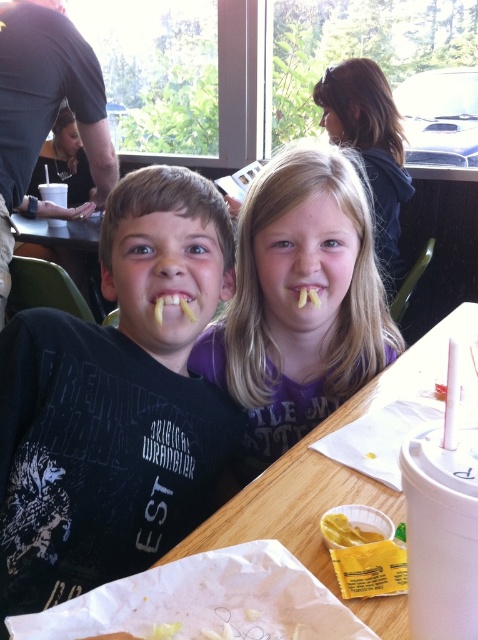
Is point (369, 115) positioned after point (155, 300)?

Yes, point (369, 115) is farther from viewer.

Does blonde hair at upper center have a smaller size compared to yellow matte french fries at center?

Incorrect, blonde hair at upper center is not smaller in size than yellow matte french fries at center.

The height and width of the screenshot is (640, 478). Identify the location of blonde hair at upper center. (369, 147).

Is matte black shirt at center to the right of yellow matte french fries at mouth center from the viewer's perspective?

In fact, matte black shirt at center is to the left of yellow matte french fries at mouth center.

Is matte black shirt at center further to the viewer compared to yellow matte french fries at mouth center?

No, matte black shirt at center is closer to the viewer.

The image size is (478, 640). What are the coordinates of `matte black shirt at center` in the screenshot? It's located at (116, 403).

Where is `matte black shirt at center`? This screenshot has height=640, width=478. matte black shirt at center is located at coordinates (116, 403).

Does matte black shirt at center appear under blonde hair at upper center?

Indeed, matte black shirt at center is positioned under blonde hair at upper center.

Does matte black shirt at center have a lesser height compared to blonde hair at upper center?

Correct, matte black shirt at center is not as tall as blonde hair at upper center.

You are a GUI agent. You are given a task and a screenshot of the screen. Output one action in this format:
    pyautogui.click(x=<x>, y=<y>)
    Task: Click on the matte black shirt at center
    The width and height of the screenshot is (478, 640).
    Given the screenshot: What is the action you would take?
    pyautogui.click(x=116, y=403)

Locate an element on the screen. Image resolution: width=478 pixels, height=640 pixels. matte black shirt at center is located at coordinates (116, 403).